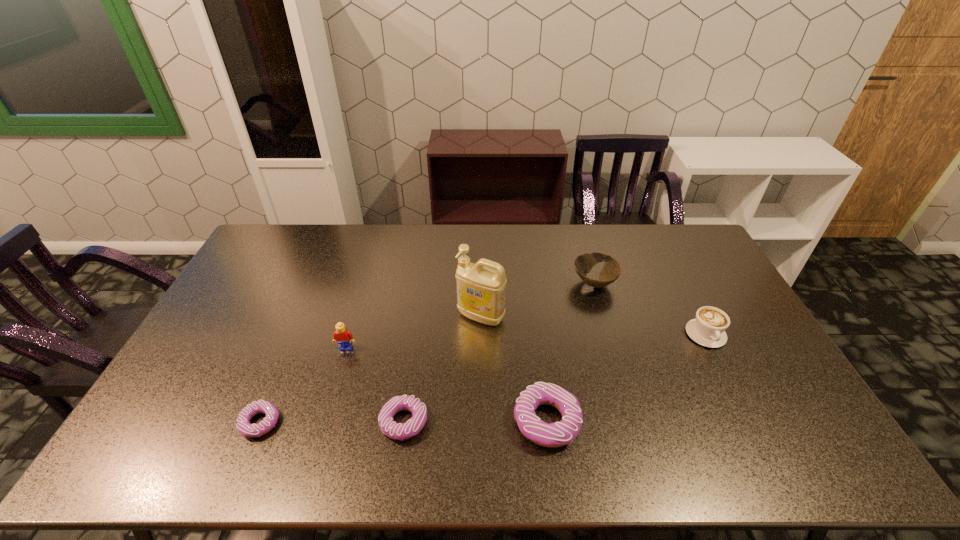
The width and height of the screenshot is (960, 540). What are the coordinates of `free spot between the rightmost doughnut and the leftmost object` in the screenshot? It's located at (403, 422).

This screenshot has width=960, height=540. Identify the location of free space between the bowl and the tallest doughnut. (570, 352).

You are a GUI agent. You are given a task and a screenshot of the screen. Output one action in this format:
    pyautogui.click(x=<x>, y=<y>)
    Task: Click on the free space between the Lego and the cappuccino
    The image size is (960, 540).
    Given the screenshot: What is the action you would take?
    pyautogui.click(x=526, y=341)

Where is `empty location between the sixth tallest object and the rightmost object`? The width and height of the screenshot is (960, 540). empty location between the sixth tallest object and the rightmost object is located at coordinates (555, 379).

The width and height of the screenshot is (960, 540). I want to click on free spot between the tallest doughnut and the leftmost doughnut, so click(x=403, y=422).

Where is `empty space that is in between the farthest object and the fourth object from left to right`? The height and width of the screenshot is (540, 960). empty space that is in between the farthest object and the fourth object from left to right is located at coordinates (538, 300).

I want to click on vacant space in between the rightmost object and the fifth object from right to left, so point(555,379).

Point out which object is positioned as the third nearest to the tallest doughnut. Please provide its 2D coordinates. Your answer should be formatted as a tuple, i.e. [(x, y)], where the tuple contains the x and y coordinates of a point satisfying the conditions above.

[(583, 263)]

Identify the location of object that is the second closest to the rightmost doughnut. The width and height of the screenshot is (960, 540). (481, 287).

Point out which doughnut is positioned as the nearest to the third object from left to right. Please provide its 2D coordinates. Your answer should be formatted as a tuple, i.e. [(x, y)], where the tuple contains the x and y coordinates of a point satisfying the conditions above.

[(561, 433)]